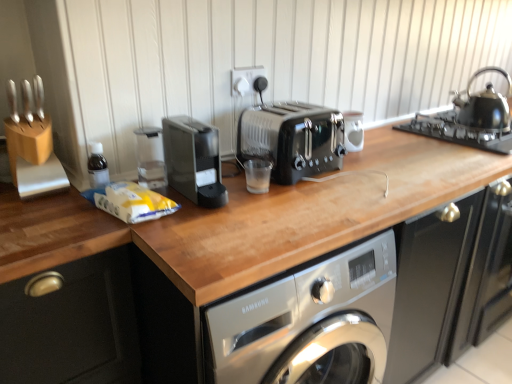
Question: Is white plastic socket at upper center located within black metallic toaster at center?

Choices:
 (A) yes
 (B) no

Answer: (B)

Question: Considering the relative sizes of black metallic toaster at center and white plastic socket at upper center in the image provided, is black metallic toaster at center smaller than white plastic socket at upper center?

Choices:
 (A) no
 (B) yes

Answer: (A)

Question: Is black metallic toaster at center taller than white plastic socket at upper center?

Choices:
 (A) no
 (B) yes

Answer: (B)

Question: From the image's perspective, is black metallic toaster at center on white plastic socket at upper center?

Choices:
 (A) yes
 (B) no

Answer: (B)

Question: From a real-world perspective, is black metallic toaster at center on top of white plastic socket at upper center?

Choices:
 (A) no
 (B) yes

Answer: (A)

Question: Considering the relative positions of white glossy coffee cup at center and white plastic socket at upper center in the image provided, is white glossy coffee cup at center to the left or to the right of white plastic socket at upper center?

Choices:
 (A) right
 (B) left

Answer: (A)

Question: From a real-world perspective, relative to white plastic socket at upper center, is white glossy coffee cup at center vertically above or below?

Choices:
 (A) below
 (B) above

Answer: (A)

Question: Is point click(x=350, y=127) closer or farther from the camera than point click(x=240, y=82)?

Choices:
 (A) closer
 (B) farther

Answer: (A)

Question: Is white glossy coffee cup at center bigger or smaller than white plastic socket at upper center?

Choices:
 (A) big
 (B) small

Answer: (A)

Question: From the image's perspective, relative to black plastic coffee machine at center, is wooden knife block at upper left above or below?

Choices:
 (A) above
 (B) below

Answer: (A)

Question: Considering the positions of wooden knife block at upper left and black plastic coffee machine at center in the image, is wooden knife block at upper left wider or thinner than black plastic coffee machine at center?

Choices:
 (A) wide
 (B) thin

Answer: (B)

Question: In terms of height, does wooden knife block at upper left look taller or shorter compared to black plastic coffee machine at center?

Choices:
 (A) short
 (B) tall

Answer: (A)

Question: Is wooden knife block at upper left in front of or behind black plastic coffee machine at center in the image?

Choices:
 (A) behind
 (B) front

Answer: (A)

Question: Is point (455, 114) positioned closer to the camera than point (476, 119)?

Choices:
 (A) farther
 (B) closer

Answer: (A)

Question: Visually, is black glass gas stove at upper right positioned to the left or to the right of shiny black kettle at upper right?

Choices:
 (A) right
 (B) left

Answer: (A)